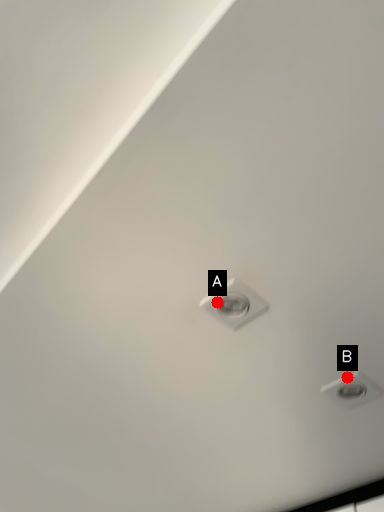
Question: Two points are circled on the image, labeled by A and B beside each circle. Which point appears closest to the camera in this image?

Choices:
 (A) A is closer
 (B) B is closer

Answer: (A)